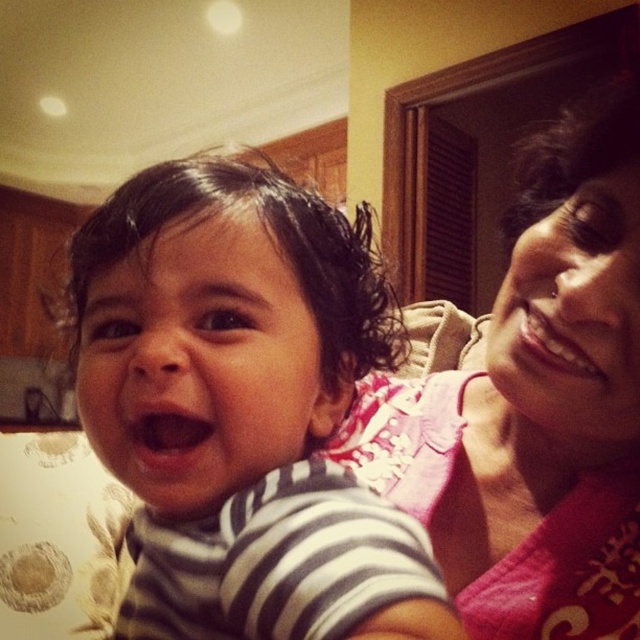
Question: Which object appears closest to the camera in this image?

Choices:
 (A) pink matte mouth at center
 (B) smooth skin smile at upper right
 (C) pink fabric at upper right

Answer: (A)

Question: Which object is farther from the camera taking this photo?

Choices:
 (A) pink fabric at upper right
 (B) smooth skin smile at upper right

Answer: (B)

Question: Does pink fabric at upper right appear under striped cotton shirt at center?

Choices:
 (A) yes
 (B) no

Answer: (B)

Question: Does smooth skin smile at upper right have a greater width compared to pink matte mouth at center?

Choices:
 (A) no
 (B) yes

Answer: (B)

Question: Which object is positioned farthest from the pink fabric at upper right?

Choices:
 (A) pink matte mouth at center
 (B) striped cotton shirt at center

Answer: (A)

Question: In this image, where is smooth skin smile at upper right located relative to pink matte mouth at center?

Choices:
 (A) left
 (B) right

Answer: (B)